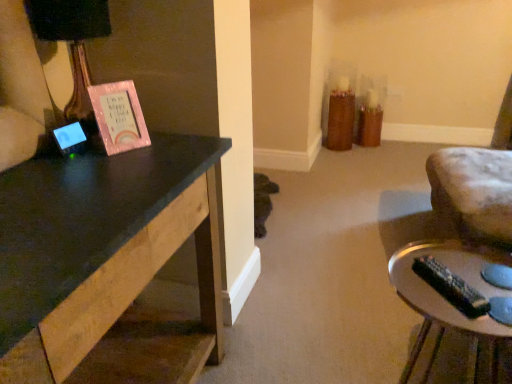
What are the coordinates of `matte black lampshade at left` in the screenshot? It's located at (73, 47).

What do you see at coordinates (73, 47) in the screenshot?
I see `matte black lampshade at left` at bounding box center [73, 47].

You are a GUI agent. You are given a task and a screenshot of the screen. Output one action in this format:
    pyautogui.click(x=<x>, y=<y>)
    Task: Click on the silver metallic remote control at lower right
    This screenshot has width=512, height=384.
    Given the screenshot: What is the action you would take?
    pyautogui.click(x=447, y=301)

What do you see at coordinates (447, 301) in the screenshot? The height and width of the screenshot is (384, 512). I see `silver metallic remote control at lower right` at bounding box center [447, 301].

This screenshot has height=384, width=512. Find the location of `matte black lampshade at left`. matte black lampshade at left is located at coordinates [73, 47].

From the picture: Can you confirm if silver metallic remote control at lower right is positioned to the right of matte black lampshade at left?

Indeed, silver metallic remote control at lower right is positioned on the right side of matte black lampshade at left.

Is silver metallic remote control at lower right further to camera compared to matte black lampshade at left?

No, the depth of silver metallic remote control at lower right is less than that of matte black lampshade at left.

Does point (422, 342) come in front of point (102, 37)?

No.

Consider the image. From the image's perspective, does silver metallic remote control at lower right appear higher than matte black lampshade at left?

No, from the image's perspective, silver metallic remote control at lower right is not over matte black lampshade at left.

From a real-world perspective, does silver metallic remote control at lower right sit lower than matte black lampshade at left?

Indeed, from a real-world perspective, silver metallic remote control at lower right is positioned beneath matte black lampshade at left.

Is silver metallic remote control at lower right wider than matte black lampshade at left?

Correct, the width of silver metallic remote control at lower right exceeds that of matte black lampshade at left.

Is silver metallic remote control at lower right taller than matte black lampshade at left?

Correct, silver metallic remote control at lower right is much taller as matte black lampshade at left.

Considering the sizes of objects silver metallic remote control at lower right and matte black lampshade at left in the image provided, who is smaller, silver metallic remote control at lower right or matte black lampshade at left?

matte black lampshade at left is smaller.

Can we say silver metallic remote control at lower right lies outside matte black lampshade at left?

Yes, silver metallic remote control at lower right is outside of matte black lampshade at left.

Is silver metallic remote control at lower right not close to matte black lampshade at left?

That's right, there is a large distance between silver metallic remote control at lower right and matte black lampshade at left.

Could you tell me if silver metallic remote control at lower right is turned towards matte black lampshade at left?

No, silver metallic remote control at lower right is not turned towards matte black lampshade at left.

Can you tell me how much silver metallic remote control at lower right and matte black lampshade at left differ in facing direction?

The angular difference between silver metallic remote control at lower right and matte black lampshade at left is 89.3 degrees.

Locate an element on the screen. table on the right of matte black lampshade at left is located at coordinates (447, 301).

Looking at this image, is matte black lampshade at left to the right of silver metallic remote control at lower right from the viewer's perspective?

No.

Which object is more forward, matte black lampshade at left or silver metallic remote control at lower right?

silver metallic remote control at lower right.

From the picture: Which is further, (89, 26) or (432, 359)?

The point (432, 359) is more distant.

From the image's perspective, which one is positioned lower, matte black lampshade at left or silver metallic remote control at lower right?

silver metallic remote control at lower right appears lower in the image.

From a real-world perspective, does matte black lampshade at left stand above silver metallic remote control at lower right?

Indeed, from a real-world perspective, matte black lampshade at left stands above silver metallic remote control at lower right.

Consider the image. Can you confirm if matte black lampshade at left is wider than silver metallic remote control at lower right?

In fact, matte black lampshade at left might be narrower than silver metallic remote control at lower right.

Is matte black lampshade at left taller or shorter than silver metallic remote control at lower right?

In the image, matte black lampshade at left appears to be shorter than silver metallic remote control at lower right.

Looking at this image, which of these two, matte black lampshade at left or silver metallic remote control at lower right, is smaller?

matte black lampshade at left.

Would you say matte black lampshade at left is outside silver metallic remote control at lower right?

That's correct, matte black lampshade at left is outside of silver metallic remote control at lower right.

Based on the photo, is matte black lampshade at left far away from silver metallic remote control at lower right?

Yes, matte black lampshade at left and silver metallic remote control at lower right are located far from each other.

Is silver metallic remote control at lower right at the back of matte black lampshade at left?

No.

How far apart are matte black lampshade at left and silver metallic remote control at lower right?

1.08 meters.

Where is `table lamp above the silver metallic remote control at lower right (from the image's perspective)`? Image resolution: width=512 pixels, height=384 pixels. table lamp above the silver metallic remote control at lower right (from the image's perspective) is located at coordinates (73, 47).

Image resolution: width=512 pixels, height=384 pixels. What are the coordinates of `table lamp behind the silver metallic remote control at lower right` in the screenshot? It's located at (73, 47).

Where is `table located in front of the matte black lampshade at left`? This screenshot has width=512, height=384. table located in front of the matte black lampshade at left is located at coordinates (447, 301).